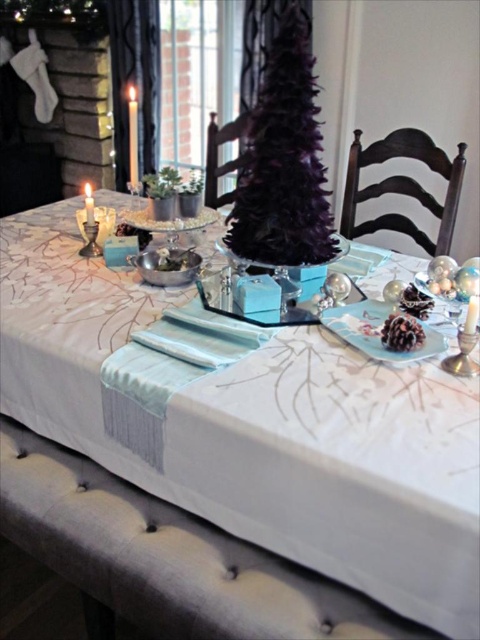
Is matte white candle at upper left bigger than matte silver candle at center?

Correct, matte white candle at upper left is larger in size than matte silver candle at center.

Looking at this image, who is positioned more to the left, matte white candle at upper left or matte silver candle at center?

Positioned to the left is matte silver candle at center.

Where is `matte white candle at upper left`? The image size is (480, 640). matte white candle at upper left is located at coordinates [x=132, y=136].

Between white satin tablecloth at center and matte white candle at upper left, which one is positioned lower?

white satin tablecloth at center is below.

You are a GUI agent. You are given a task and a screenshot of the screen. Output one action in this format:
    pyautogui.click(x=<x>, y=<y>)
    Task: Click on the white satin tablecloth at center
    The height and width of the screenshot is (640, 480).
    Given the screenshot: What is the action you would take?
    pyautogui.click(x=260, y=429)

Does white satin tablecloth at center appear over matte silver candle at center?

No.

Does white satin tablecloth at center have a larger size compared to matte silver candle at center?

Correct, white satin tablecloth at center is larger in size than matte silver candle at center.

Does point (196, 420) come in front of point (93, 224)?

Yes, it is.

Find the location of a particular element. The width and height of the screenshot is (480, 640). white satin tablecloth at center is located at coordinates (260, 429).